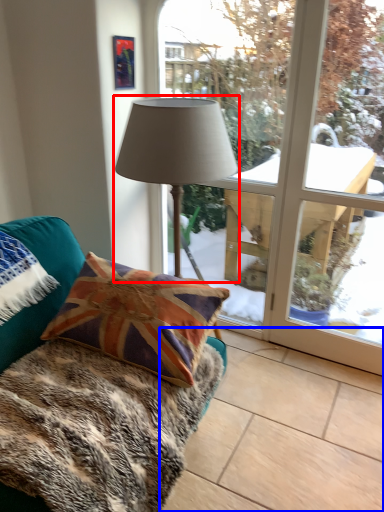
Question: Which object is further to the camera taking this photo, lamp (highlighted by a red box) or tile (highlighted by a blue box)?

Choices:
 (A) lamp
 (B) tile

Answer: (A)